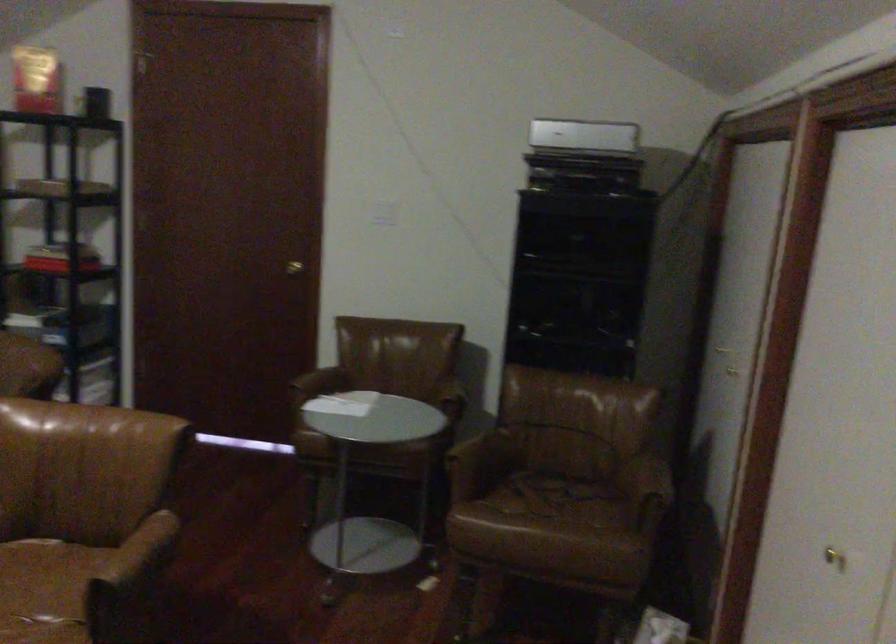
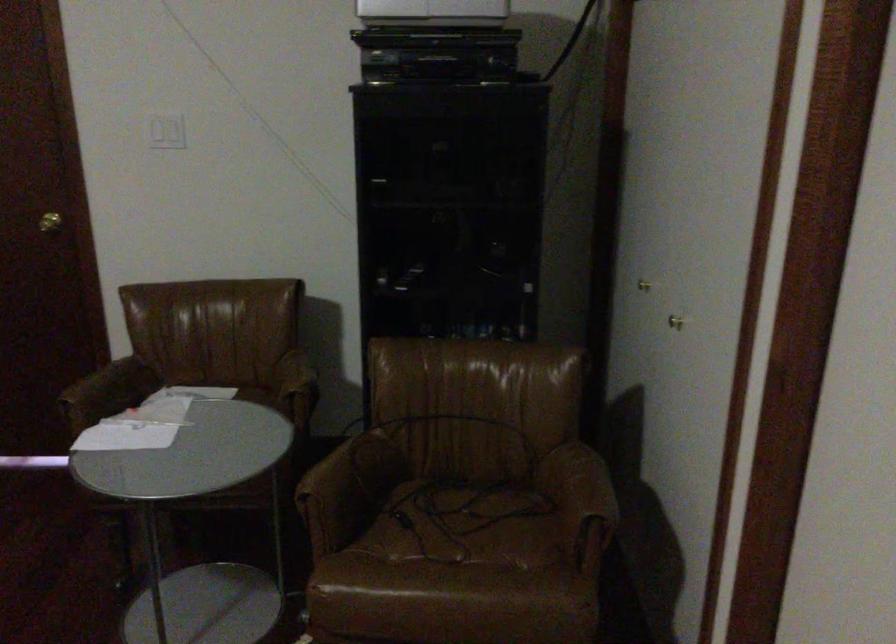
Find the pixel in the second image that matches point 645,478 in the first image.

(582, 485)